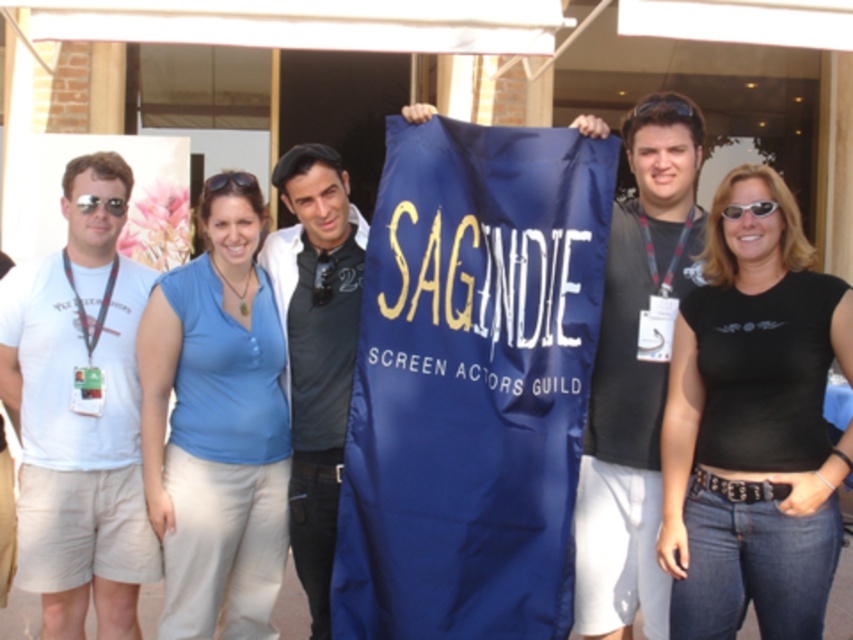
Question: Does matte black shirt at center have a lesser width compared to matte black sunglasses at left?

Choices:
 (A) yes
 (B) no

Answer: (B)

Question: Which point is closer to the camera?

Choices:
 (A) (770, 202)
 (B) (669, 541)
 (C) (320, 150)

Answer: (A)

Question: Based on their relative distances, which object is farther from the black plastic goggles at upper center?

Choices:
 (A) blue fabric shirt at center
 (B) dark gray shirt at center

Answer: (A)

Question: Which of these objects is positioned farthest from the black cotton shirt at center?

Choices:
 (A) dark gray shirt at center
 (B) black plastic goggles at upper center

Answer: (B)

Question: Does white cotton t-shirt at left appear on the left side of blue fabric shirt at center?

Choices:
 (A) yes
 (B) no

Answer: (A)

Question: Is black cotton shirt at center wider than matte black shirt at center?

Choices:
 (A) yes
 (B) no

Answer: (A)